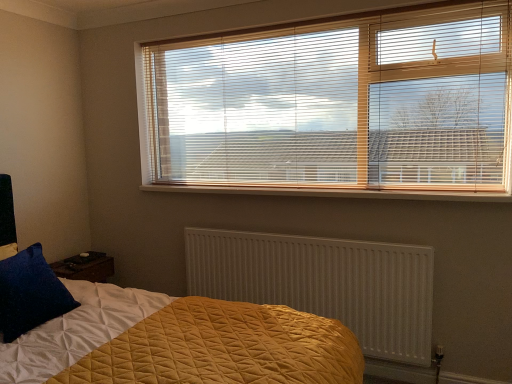
Question: From a real-world perspective, is wooden blinds at upper center physically located above or below wooden at center?

Choices:
 (A) below
 (B) above

Answer: (B)

Question: Considering the positions of point [266, 188] and point [217, 193], is point [266, 188] closer or farther from the camera than point [217, 193]?

Choices:
 (A) farther
 (B) closer

Answer: (B)

Question: Considering the real-world distances, which object is farthest from the white textured radiator at center?

Choices:
 (A) velvety blue pillow at lower left
 (B) wooden blinds at upper center
 (C) wooden at center

Answer: (A)

Question: Estimate the real-world distances between objects in this image. Which object is closer to the wooden blinds at upper center?

Choices:
 (A) velvety blue pillow at lower left
 (B) white textured radiator at center
 (C) wooden at center

Answer: (C)